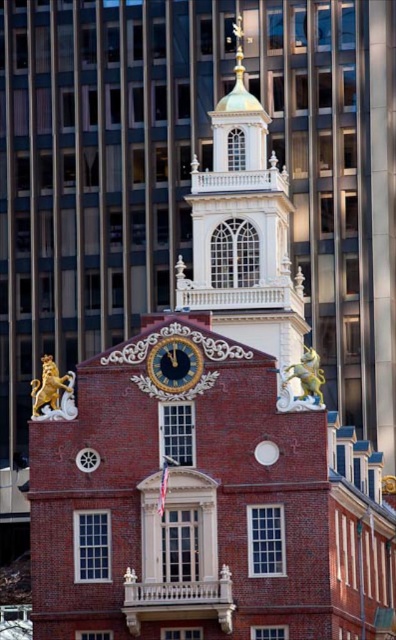
Question: Estimate the real-world distances between objects in this image. Which object is farther from the gold metallic clock at center?

Choices:
 (A) gold polished metal lion at upper left
 (B) gold/gilded metal bell tower at upper center
 (C) gold polished metal horse at upper right

Answer: (B)

Question: Is gold metallic clock at center to the left of gold polished metal lion at upper left from the viewer's perspective?

Choices:
 (A) yes
 (B) no

Answer: (B)

Question: Estimate the real-world distances between objects in this image. Which object is farther from the gold metallic clock at center?

Choices:
 (A) gold polished metal horse at upper right
 (B) gold polished metal lion at upper left
 (C) gold/gilded metal bell tower at upper center

Answer: (C)

Question: Does gold/gilded metal bell tower at upper center come behind gold metallic clock at center?

Choices:
 (A) yes
 (B) no

Answer: (A)

Question: Which point is closer to the camera?

Choices:
 (A) gold polished metal horse at upper right
 (B) gold polished metal lion at upper left
 (C) gold metallic clock at center
 (D) gold/gilded metal bell tower at upper center

Answer: (A)

Question: Does gold polished metal lion at upper left have a lesser width compared to gold polished metal horse at upper right?

Choices:
 (A) no
 (B) yes

Answer: (A)